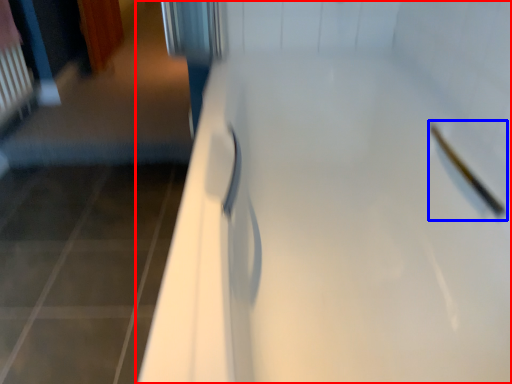
Question: Which object is closer to the camera taking this photo, door (highlighted by a red box) or shower (highlighted by a blue box)?

Choices:
 (A) door
 (B) shower

Answer: (A)